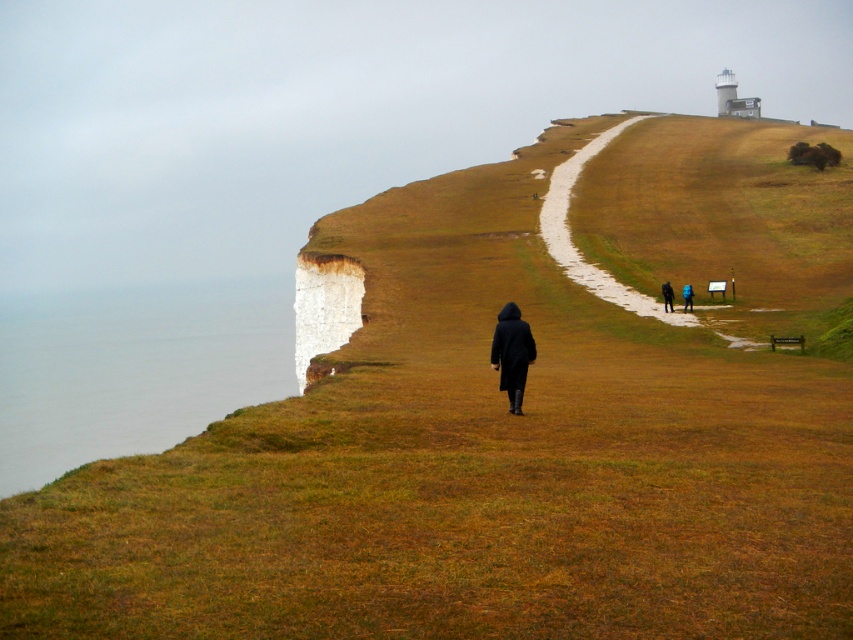
Question: Which object appears closest to the camera in this image?

Choices:
 (A) gravel pathway at upper right
 (B) dark blue coat at center-right
 (C) matte black coat at center

Answer: (C)

Question: Among these objects, which one is farthest from the camera?

Choices:
 (A) dark blue jacket at center
 (B) brown grassy hillside at center
 (C) matte black coat at center
 (D) dark blue coat at center-right

Answer: (A)

Question: Does brown grassy hillside at center have a greater width compared to gravel pathway at upper right?

Choices:
 (A) yes
 (B) no

Answer: (A)

Question: Among these objects, which one is nearest to the camera?

Choices:
 (A) matte black coat at center
 (B) brown grassy hillside at center
 (C) dark blue jacket at center
 (D) dark blue coat at center-right

Answer: (A)

Question: Is gravel pathway at upper right below dark blue coat at center-right?

Choices:
 (A) no
 (B) yes

Answer: (A)

Question: Can you confirm if brown grassy hillside at center is positioned to the right of matte black coat at center?

Choices:
 (A) yes
 (B) no

Answer: (A)